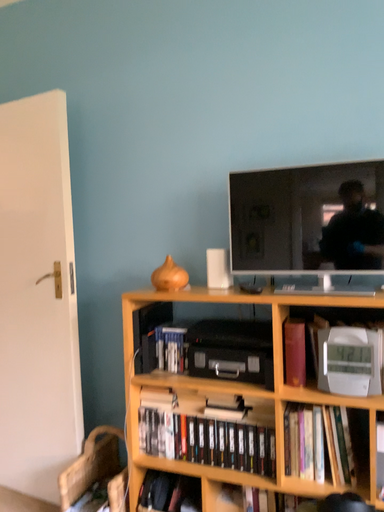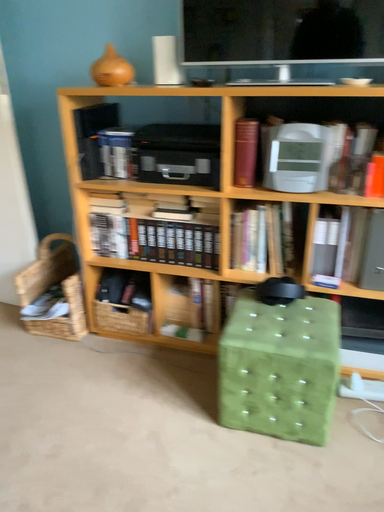
Question: How did the camera likely rotate when shooting the video?

Choices:
 (A) rotated upward
 (B) rotated downward

Answer: (B)